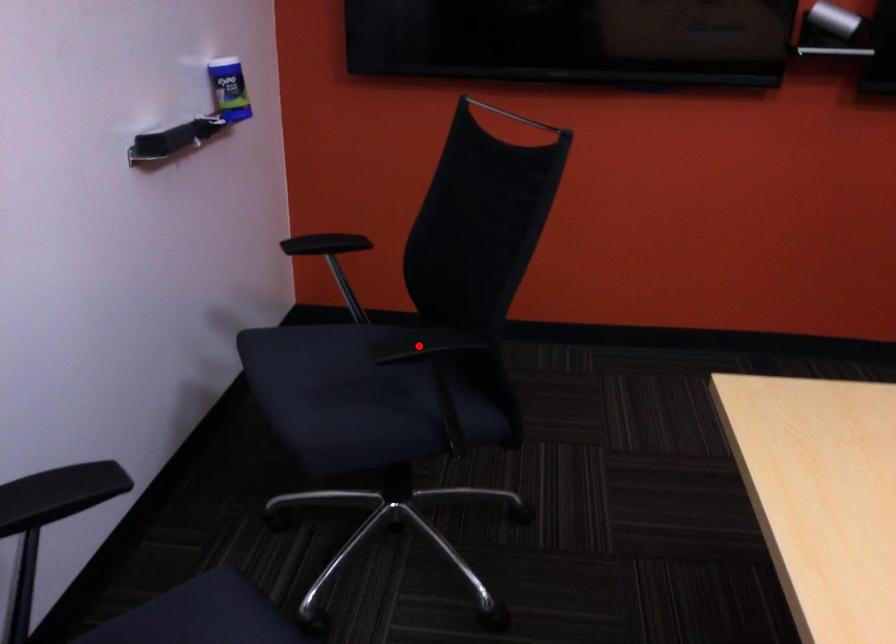
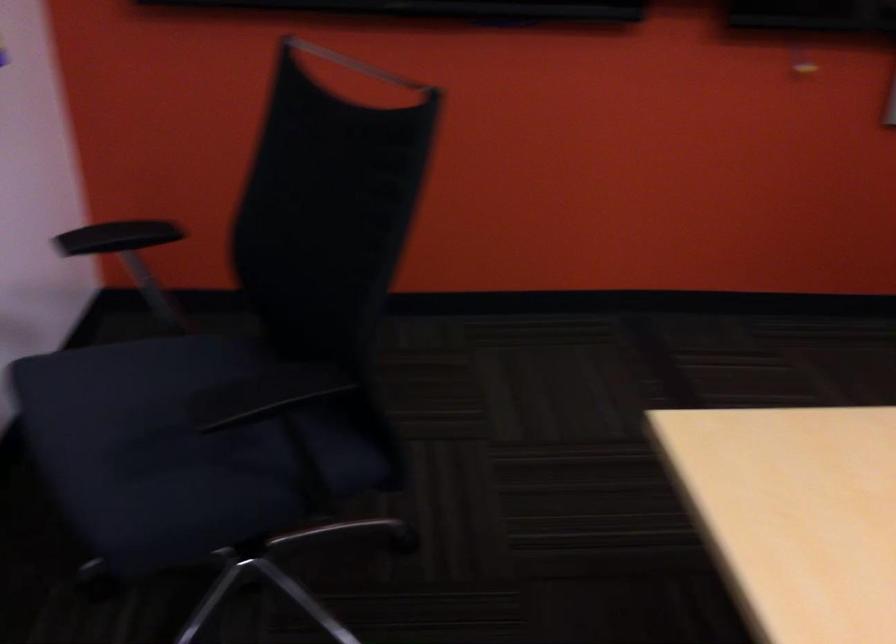
The point at the highlighted location is marked in the first image. Where is the corresponding point in the second image?

(264, 395)